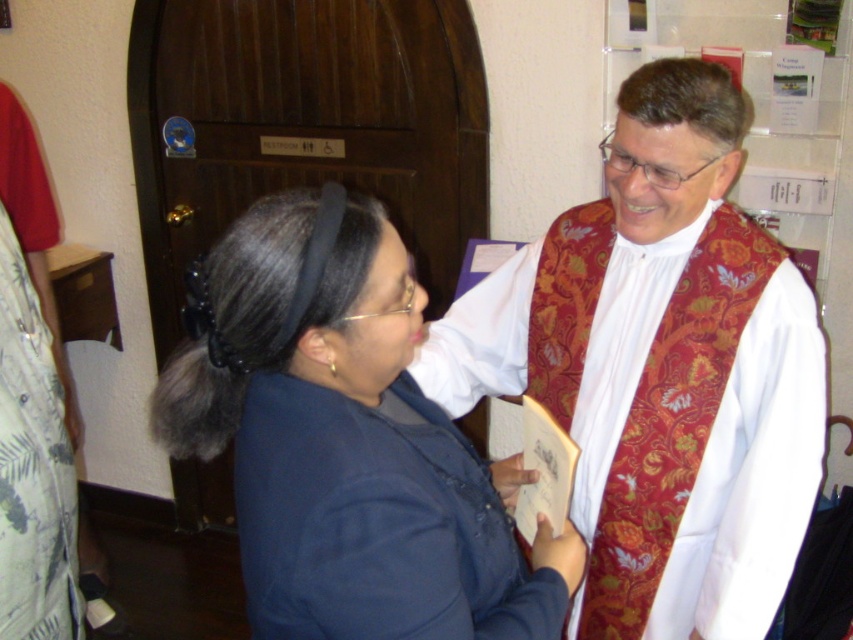
Question: Which of the following is the closest to the observer?

Choices:
 (A) printed cotton robe at left
 (B) blue fabric robe at lower left
 (C) matte red vest at center
 (D) dark blue fabric at center

Answer: (B)

Question: Which object is the farthest from the blue fabric robe at lower left?

Choices:
 (A) matte red vest at center
 (B) dark blue fabric at center

Answer: (A)

Question: Does blue fabric robe at lower left have a greater width compared to printed cotton robe at left?

Choices:
 (A) yes
 (B) no

Answer: (A)

Question: From the image, what is the correct spatial relationship of dark blue fabric at center in relation to printed cotton robe at left?

Choices:
 (A) left
 (B) right

Answer: (B)

Question: In this image, where is dark blue fabric at center located relative to printed cotton robe at left?

Choices:
 (A) right
 (B) left

Answer: (A)

Question: Which point appears closest to the camera in this image?

Choices:
 (A) click(x=439, y=556)
 (B) click(x=785, y=560)
 (C) click(x=393, y=620)
 (D) click(x=9, y=493)

Answer: (C)